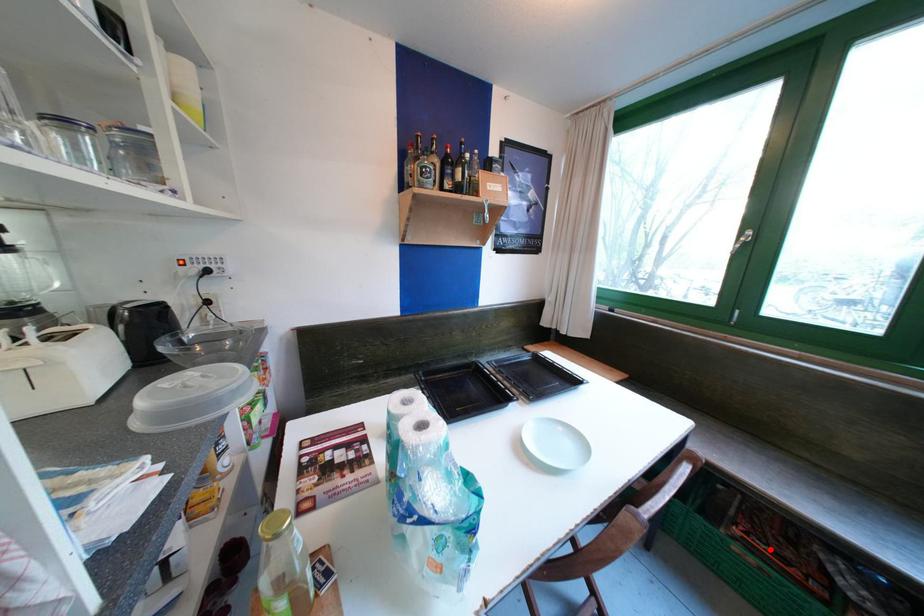
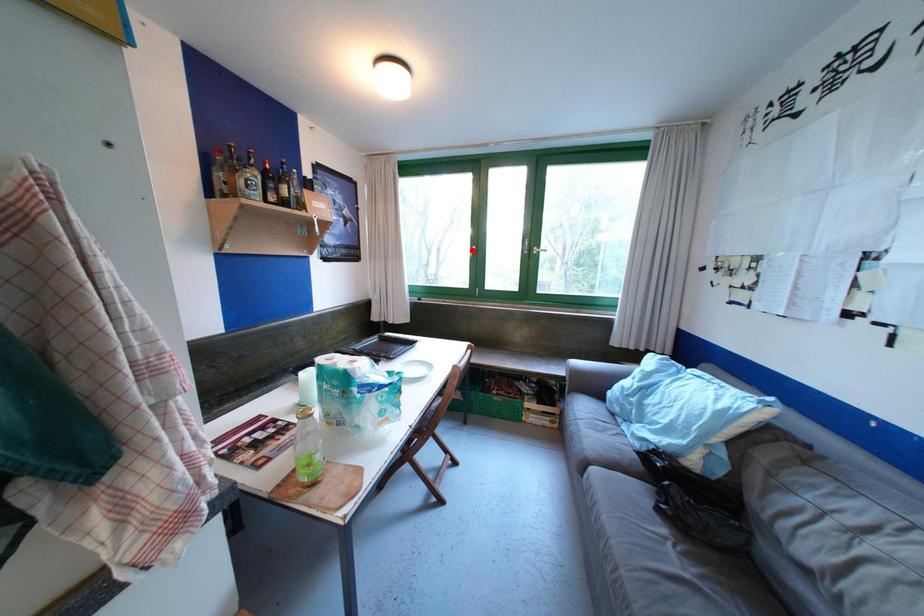
I am providing you with two images of the same scene from different viewpoints. A red point is marked on the first image and another point is marked on the second image. Do the highlighted points in image1 and image2 indicate the same real-world spot?

No